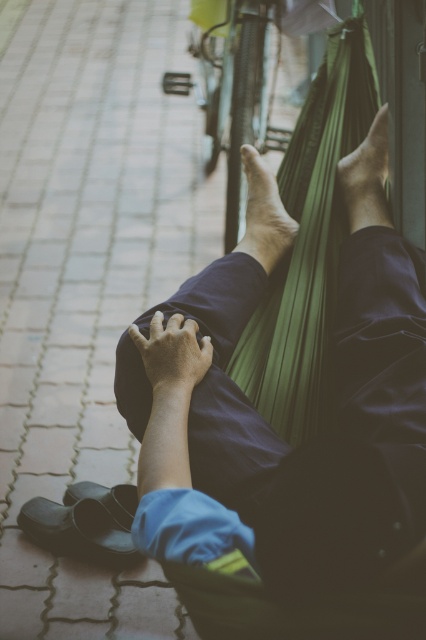
Question: Estimate the real-world distances between objects in this image. Which object is closer to the smooth skin foot at center?

Choices:
 (A) green fabric hammock at upper center
 (B) smooth skin foot at upper center

Answer: (B)

Question: Is green fabric hammock at upper center closer to camera compared to smooth skin foot at upper center?

Choices:
 (A) yes
 (B) no

Answer: (A)

Question: Which of the following is the farthest from the observer?

Choices:
 (A) smooth skin foot at upper center
 (B) green fabric hammock at upper center

Answer: (A)

Question: Which point is farther to the camera?

Choices:
 (A) (264, 168)
 (B) (69, 493)
 (C) (359, 156)

Answer: (B)

Question: Does green fabric hammock at upper center have a greater width compared to smooth skin foot at upper center?

Choices:
 (A) yes
 (B) no

Answer: (A)

Question: Can you confirm if green fabric hammock at upper center is wider than black leather sandal at lower left?

Choices:
 (A) no
 (B) yes

Answer: (B)